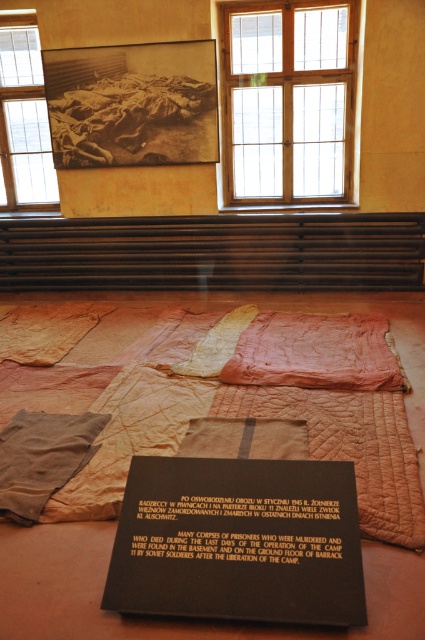
Question: Which object appears closest to the camera in this image?

Choices:
 (A) clear glass window at upper left
 (B) wooden frame at upper center
 (C) black polished stone plaque at center

Answer: (C)

Question: Observing the image, what is the correct spatial positioning of black polished stone plaque at center in reference to wooden frame at upper center?

Choices:
 (A) right
 (B) left

Answer: (B)

Question: Is wooden frame at upper center bigger than black paper at center?

Choices:
 (A) no
 (B) yes

Answer: (B)

Question: Which is farther from the black polished stone plaque at center?

Choices:
 (A) clear glass window at upper left
 (B) black paper at center

Answer: (A)

Question: Which of the following is the closest to the observer?

Choices:
 (A) (226, 540)
 (B) (277, 584)
 (C) (314, 72)

Answer: (B)

Question: Where is wooden frame at upper center located in relation to clear glass window at upper left in the image?

Choices:
 (A) right
 (B) left

Answer: (A)